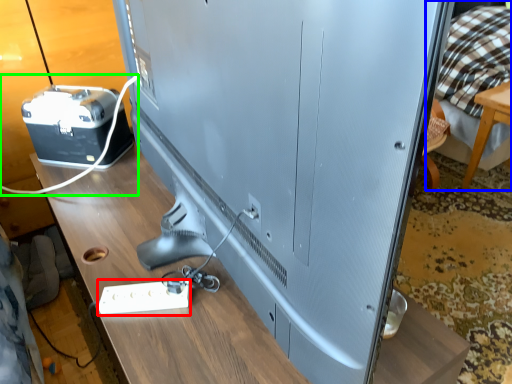
Question: Based on their relative distances, which object is nearer to extension cord (highlighted by a red box)? Choose from bed (highlighted by a blue box) and wire (highlighted by a green box).

Choices:
 (A) bed
 (B) wire

Answer: (B)